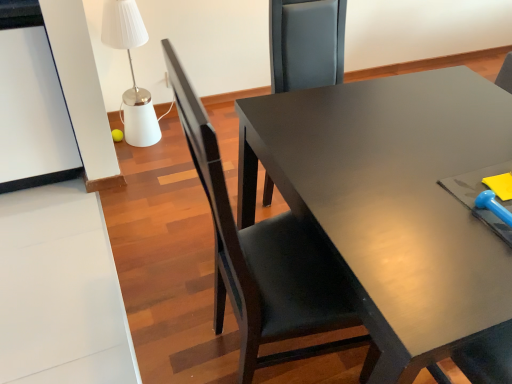
Question: Should I look upward or downward to see white glossy table lamp at upper left?

Choices:
 (A) up
 (B) down

Answer: (A)

Question: Is white glossy table lamp at upper left oriented towards matte black chair at center?

Choices:
 (A) no
 (B) yes

Answer: (B)

Question: Is white glossy table lamp at upper left behind matte black chair at center?

Choices:
 (A) yes
 (B) no

Answer: (A)

Question: Is white glossy table lamp at upper left shorter than matte black chair at center?

Choices:
 (A) no
 (B) yes

Answer: (B)

Question: From the image's perspective, is white glossy table lamp at upper left on top of matte black chair at center?

Choices:
 (A) yes
 (B) no

Answer: (A)

Question: From a real-world perspective, is white glossy table lamp at upper left located higher than matte black chair at center?

Choices:
 (A) yes
 (B) no

Answer: (B)

Question: Is the position of white glossy table lamp at upper left less distant than that of matte black chair at center?

Choices:
 (A) no
 (B) yes

Answer: (A)

Question: Considering the relative sizes of matte black chair at center and white glossy table lamp at upper left in the image provided, is matte black chair at center bigger than white glossy table lamp at upper left?

Choices:
 (A) yes
 (B) no

Answer: (A)

Question: Is matte black chair at center smaller than white glossy table lamp at upper left?

Choices:
 (A) no
 (B) yes

Answer: (A)

Question: From the image's perspective, does matte black chair at center appear lower than white glossy table lamp at upper left?

Choices:
 (A) yes
 (B) no

Answer: (A)

Question: Is matte black chair at center far away from white glossy table lamp at upper left?

Choices:
 (A) no
 (B) yes

Answer: (B)

Question: Is matte black chair at center aimed at white glossy table lamp at upper left?

Choices:
 (A) yes
 (B) no

Answer: (B)

Question: Is white glossy table lamp at upper left located within matte black chair at center?

Choices:
 (A) yes
 (B) no

Answer: (B)

Question: In terms of height, does white glossy table lamp at upper left look taller or shorter compared to matte black chair at center?

Choices:
 (A) tall
 (B) short

Answer: (B)